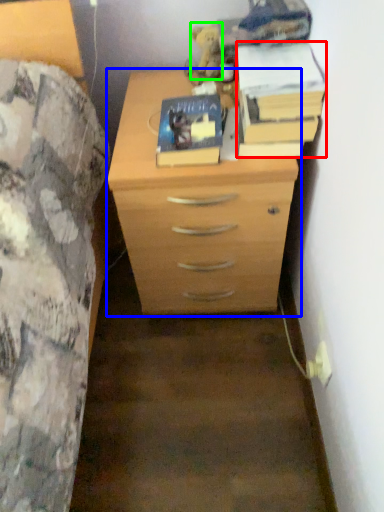
Question: Which is nearer to the paperback book (highlighted by a red box)? chest of drawers (highlighted by a blue box) or toy (highlighted by a green box).

Choices:
 (A) chest of drawers
 (B) toy

Answer: (A)